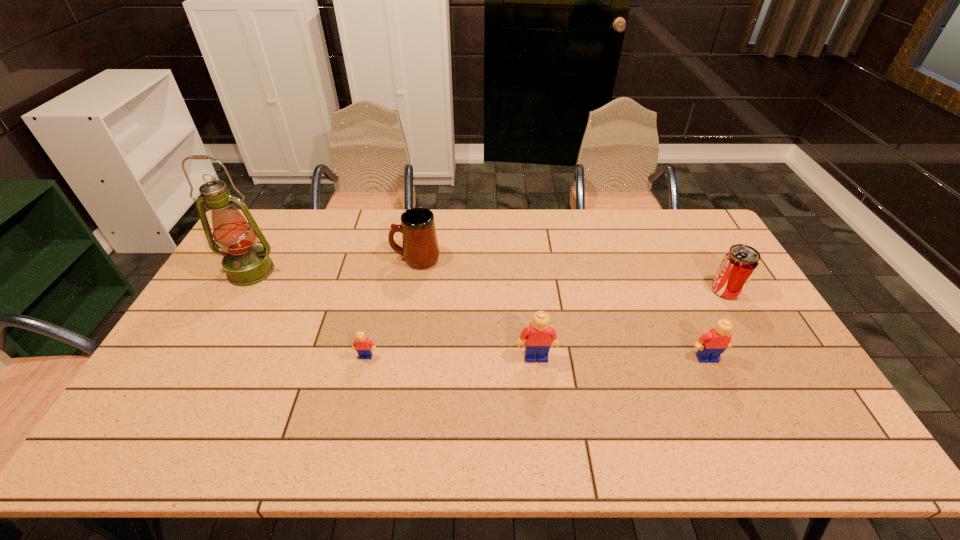
Find the location of a particular element. The height and width of the screenshot is (540, 960). free space located on the face of the second tallest Lego is located at coordinates (731, 410).

Image resolution: width=960 pixels, height=540 pixels. I want to click on vacant area situated on the side of the mug with the handle, so click(280, 259).

Locate an element on the screen. blank area located 0.260m on the side of the mug with the handle is located at coordinates (316, 259).

Image resolution: width=960 pixels, height=540 pixels. Identify the location of free space located on the side of the mug with the handle. (350, 259).

You are a GUI agent. You are given a task and a screenshot of the screen. Output one action in this format:
    pyautogui.click(x=<x>, y=<y>)
    Task: Click on the free spot located on the right of the leftmost object
    
    Given the screenshot: What is the action you would take?
    pyautogui.click(x=328, y=271)

Where is `free region located on the left of the pop soda`? Image resolution: width=960 pixels, height=540 pixels. free region located on the left of the pop soda is located at coordinates (613, 291).

Where is `object present at the far edge`? Image resolution: width=960 pixels, height=540 pixels. object present at the far edge is located at coordinates (420, 250).

In order to click on object present at the left edge in this screenshot , I will do `click(245, 263)`.

At what (x,y) coordinates should I click in order to perform the action: click on object that is at the right edge. Please return your answer as a coordinate pair (x, y). The height and width of the screenshot is (540, 960). Looking at the image, I should click on click(739, 264).

In the image, there is a desktop. Identify the location of blank space at the far edge. (599, 221).